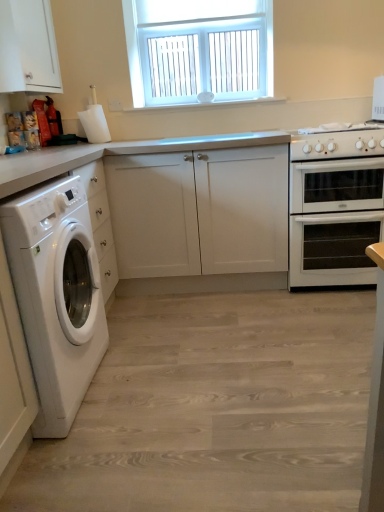
Question: Is white matte cabinet at left, the second cabinetry positioned from the left, positioned behind white matte cabinet at upper left, placed as the 1th cabinetry when sorted from top to bottom?

Choices:
 (A) yes
 (B) no

Answer: (A)

Question: Does white matte cabinet at left, the second cabinetry positioned from the left, lie in front of white matte cabinet at upper left, placed as the 1th cabinetry when sorted from top to bottom?

Choices:
 (A) no
 (B) yes

Answer: (A)

Question: Does white matte cabinet at left, which appears as the 1th cabinetry when viewed from the right, appear on the left side of white matte cabinet at upper left, which appears as the 1th cabinetry when viewed from the left?

Choices:
 (A) yes
 (B) no

Answer: (B)

Question: From the image's perspective, is white matte cabinet at left, which appears as the second cabinetry when viewed from the top, below white matte cabinet at upper left, acting as the second cabinetry starting from the bottom?

Choices:
 (A) yes
 (B) no

Answer: (A)

Question: Is white matte cabinet at left, which appears as the second cabinetry when viewed from the top, surrounding white matte cabinet at upper left, which appears as the 1th cabinetry when viewed from the left?

Choices:
 (A) yes
 (B) no

Answer: (B)

Question: Considering their positions, is white matte cabinet at upper left, placed as the 1th cabinetry when sorted from top to bottom, located in front of or behind white matte cabinet at left, which appears as the 1th cabinetry when viewed from the right?

Choices:
 (A) front
 (B) behind

Answer: (A)

Question: From the image's perspective, is white matte cabinet at upper left, which appears as the 1th cabinetry when viewed from the left, above or below white matte cabinet at left, the 1th cabinetry in the bottom-to-top sequence?

Choices:
 (A) below
 (B) above

Answer: (B)

Question: Is white matte cabinet at upper left, positioned as the 2th cabinetry in right-to-left order, bigger or smaller than white matte cabinet at left, which appears as the second cabinetry when viewed from the top?

Choices:
 (A) big
 (B) small

Answer: (B)

Question: From their relative heights in the image, would you say white matte cabinet at upper left, which appears as the 1th cabinetry when viewed from the left, is taller or shorter than white matte cabinet at left, the second cabinetry positioned from the left?

Choices:
 (A) tall
 (B) short

Answer: (B)

Question: From a real-world perspective, is white glossy washing machine at left above or below white matte cabinet at left, the 1th cabinetry in the bottom-to-top sequence?

Choices:
 (A) above
 (B) below

Answer: (B)

Question: From the image's perspective, relative to white matte cabinet at left, which appears as the 1th cabinetry when viewed from the right, is white glossy washing machine at left above or below?

Choices:
 (A) below
 (B) above

Answer: (A)

Question: Considering the positions of point (66, 178) and point (251, 263), is point (66, 178) closer or farther from the camera than point (251, 263)?

Choices:
 (A) closer
 (B) farther

Answer: (A)

Question: Considering the positions of white glossy washing machine at left and white matte cabinet at left, which appears as the second cabinetry when viewed from the top, in the image, is white glossy washing machine at left wider or thinner than white matte cabinet at left, which appears as the second cabinetry when viewed from the top,?

Choices:
 (A) wide
 (B) thin

Answer: (B)

Question: Is white plastic window at upper center wider or thinner than white glossy washing machine at left?

Choices:
 (A) thin
 (B) wide

Answer: (A)

Question: Considering the positions of white plastic window at upper center and white glossy washing machine at left in the image, is white plastic window at upper center bigger or smaller than white glossy washing machine at left?

Choices:
 (A) big
 (B) small

Answer: (B)